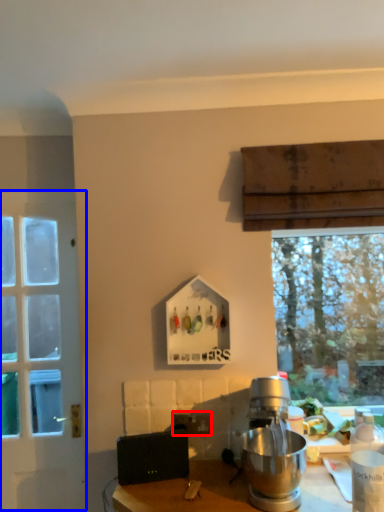
Question: Which object is closer to the camera taking this photo, power outlet (highlighted by a red box) or door (highlighted by a blue box)?

Choices:
 (A) power outlet
 (B) door

Answer: (A)